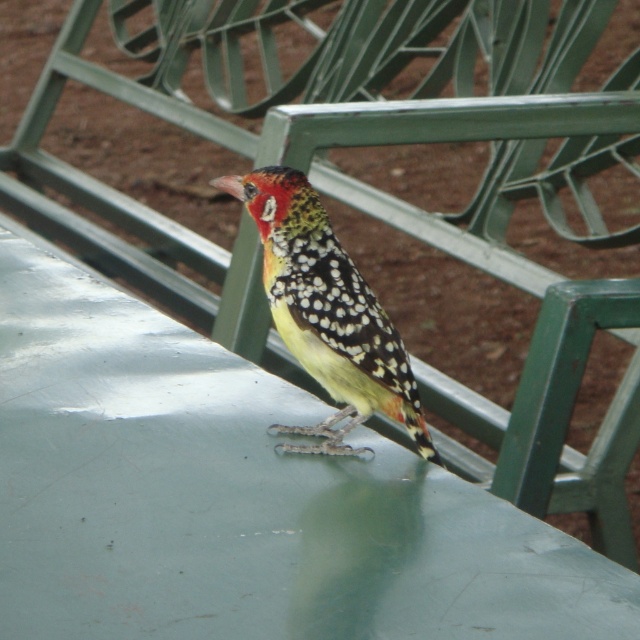
Question: Which object is farther from the camera taking this photo?

Choices:
 (A) green matte table at center
 (B) speckled feathered bird at center

Answer: (B)

Question: Among these points, which one is nearest to the camera?

Choices:
 (A) (406, 586)
 (B) (364, 419)

Answer: (A)

Question: Can you confirm if green matte table at center is positioned above speckled feathered bird at center?

Choices:
 (A) yes
 (B) no

Answer: (B)

Question: In this image, where is green matte table at center located relative to speckled feathered bird at center?

Choices:
 (A) right
 (B) left

Answer: (B)

Question: Which point is farther to the camera?

Choices:
 (A) speckled feathered bird at center
 (B) green matte table at center

Answer: (A)

Question: Can you confirm if green matte table at center is wider than speckled feathered bird at center?

Choices:
 (A) yes
 (B) no

Answer: (A)